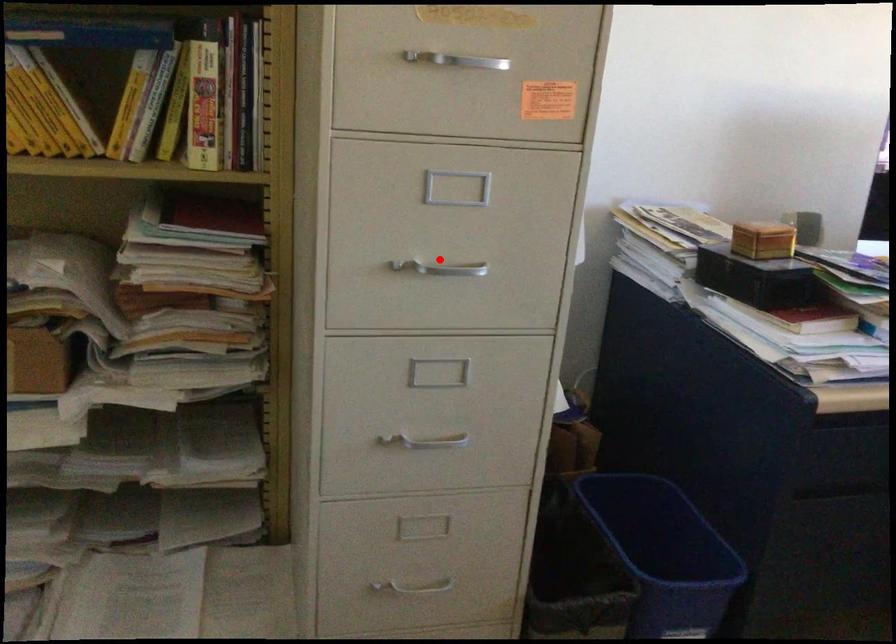
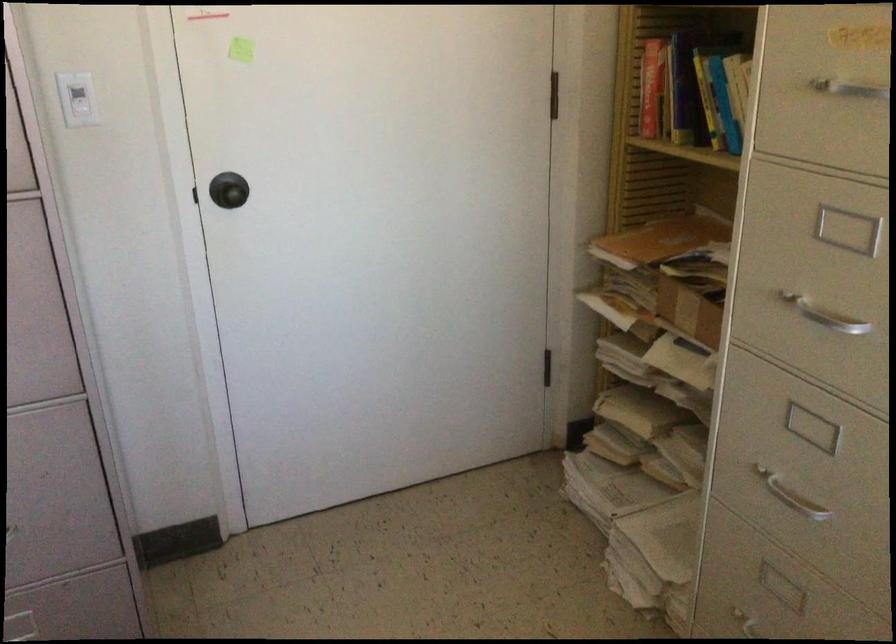
In the second image, find the point that corresponds to the highlighted location in the first image.

(824, 315)